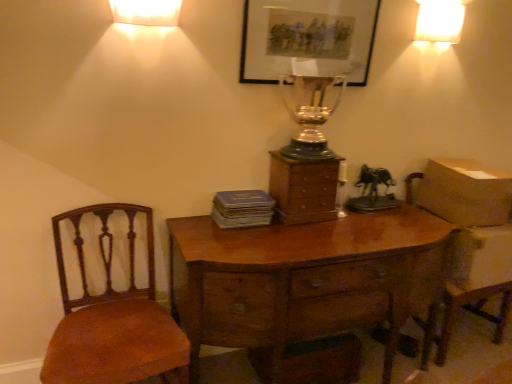
Where is `vacant space situated above wooden desk at center (from a real-world perspective)`? vacant space situated above wooden desk at center (from a real-world perspective) is located at coordinates (284, 233).